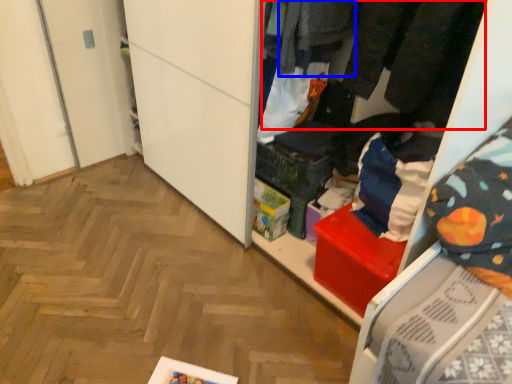
Question: Which object appears closest to the camera in this image, clothing (highlighted by a red box) or clothing (highlighted by a blue box)?

Choices:
 (A) clothing
 (B) clothing

Answer: (A)